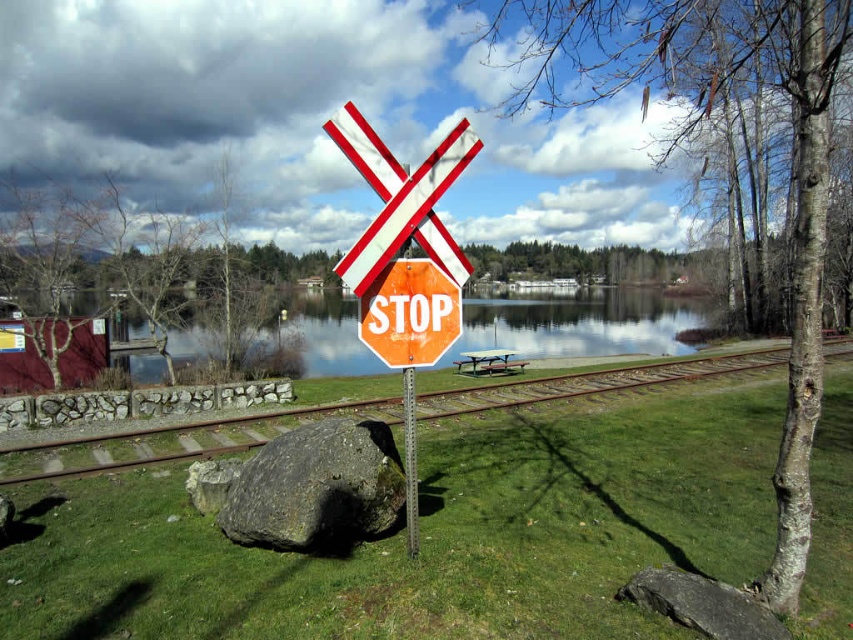
Does glossy reflective water at center have a lesser height compared to orange matte stop sign at center?

In fact, glossy reflective water at center may be taller than orange matte stop sign at center.

Between point (505, 342) and point (439, 355), which one is positioned behind?

Point (505, 342)

Which is behind, point (683, 348) or point (378, 330)?

Point (683, 348)

This screenshot has width=853, height=640. What are the coordinates of `glossy reflective water at center` in the screenshot? It's located at (582, 324).

Does glossy reflective water at center appear on the left side of metal train track at center?

Correct, you'll find glossy reflective water at center to the left of metal train track at center.

Can you confirm if glossy reflective water at center is positioned below metal train track at center?

Incorrect, glossy reflective water at center is not positioned below metal train track at center.

Describe the element at coordinates (582, 324) in the screenshot. The image size is (853, 640). I see `glossy reflective water at center` at that location.

Locate an element on the screen. This screenshot has height=640, width=853. glossy reflective water at center is located at coordinates (582, 324).

Between metal train track at center and metallic pole at center, which one is positioned higher?

Positioned higher is metallic pole at center.

Between point (49, 445) and point (405, 417), which one is positioned in front?

Point (405, 417) is in front.

Is point (161, 444) more distant than point (405, 486)?

Yes, it is.

You are a GUI agent. You are given a task and a screenshot of the screen. Output one action in this format:
    pyautogui.click(x=<x>, y=<y>)
    Task: Click on the metal train track at center
    
    Given the screenshot: What is the action you would take?
    pyautogui.click(x=178, y=442)